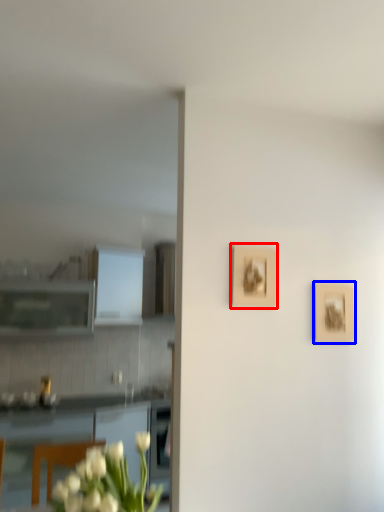
Question: Which object is closer to the camera taking this photo, picture frame (highlighted by a red box) or picture frame (highlighted by a blue box)?

Choices:
 (A) picture frame
 (B) picture frame

Answer: (A)